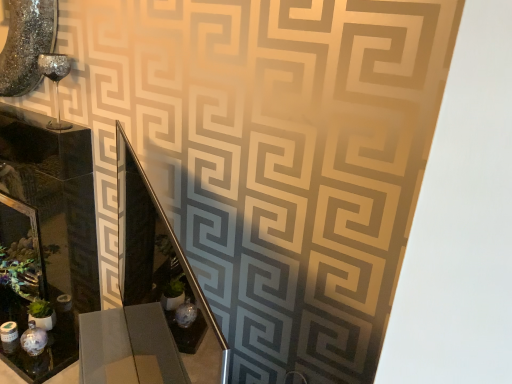
Question: From a real-world perspective, relative to matte black glass box at left, is matte glass picture frame at lower left vertically above or below?

Choices:
 (A) above
 (B) below

Answer: (B)

Question: Considering the positions of point pos(31,218) and point pos(57,145), is point pos(31,218) closer or farther from the camera than point pos(57,145)?

Choices:
 (A) farther
 (B) closer

Answer: (A)

Question: Which object is the farthest from the metallic silver vanity at center?

Choices:
 (A) matte black glass box at left
 (B) matte glass picture frame at lower left

Answer: (B)

Question: Which is nearer to the matte black glass box at left?

Choices:
 (A) metallic silver vanity at center
 (B) matte glass picture frame at lower left

Answer: (B)